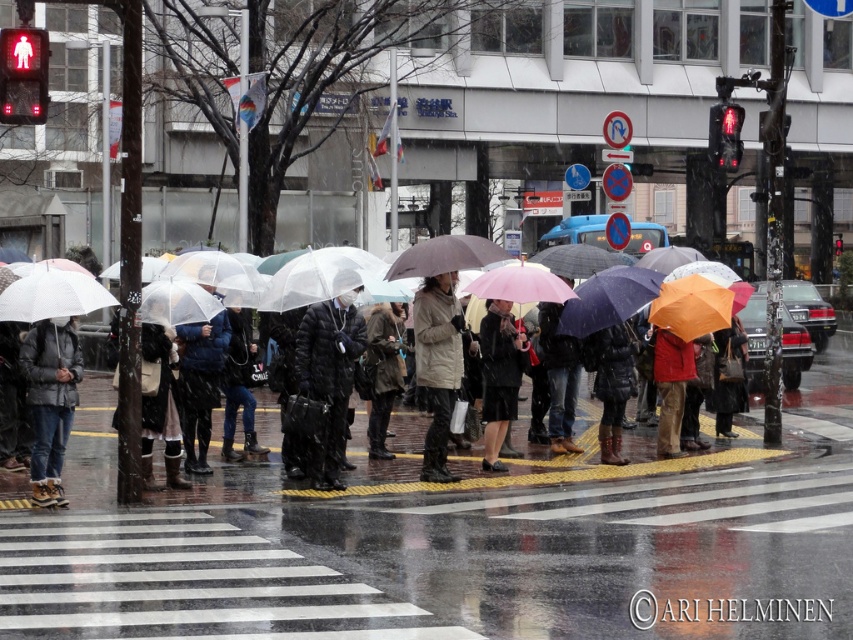
Who is positioned more to the left, transparent plastic umbrellas at lower left or matte black coat at center?

matte black coat at center is more to the left.

At what (x,y) coordinates should I click in order to perform the action: click on transparent plastic umbrellas at lower left. Please return your answer as a coordinate pair (x, y). The height and width of the screenshot is (640, 853). Looking at the image, I should click on (537, 472).

Does point (646, 467) lie in front of point (512, 339)?

No, (646, 467) is further to viewer.

Where is `transparent plastic umbrellas at lower left`? The width and height of the screenshot is (853, 640). transparent plastic umbrellas at lower left is located at coordinates (537, 472).

Looking at this image, who is shorter, light brown leather boots at center or dark green fabric coat at center?

With less height is dark green fabric coat at center.

At what (x,y) coordinates should I click in order to perform the action: click on light brown leather boots at center. Please return your answer as a coordinate pair (x, y). The height and width of the screenshot is (640, 853). Looking at the image, I should click on (437, 365).

Locate an element on the screen. Image resolution: width=853 pixels, height=640 pixels. light brown leather boots at center is located at coordinates (437, 365).

Is transparent plastic umbrella at center to the left of matte black coat at center from the viewer's perspective?

In fact, transparent plastic umbrella at center is to the right of matte black coat at center.

Does transparent plastic umbrella at center have a greater height compared to matte black coat at center?

No.

The width and height of the screenshot is (853, 640). Describe the element at coordinates (624, 294) in the screenshot. I see `transparent plastic umbrella at center` at that location.

The height and width of the screenshot is (640, 853). What are the coordinates of `transparent plastic umbrella at center` in the screenshot? It's located at (624, 294).